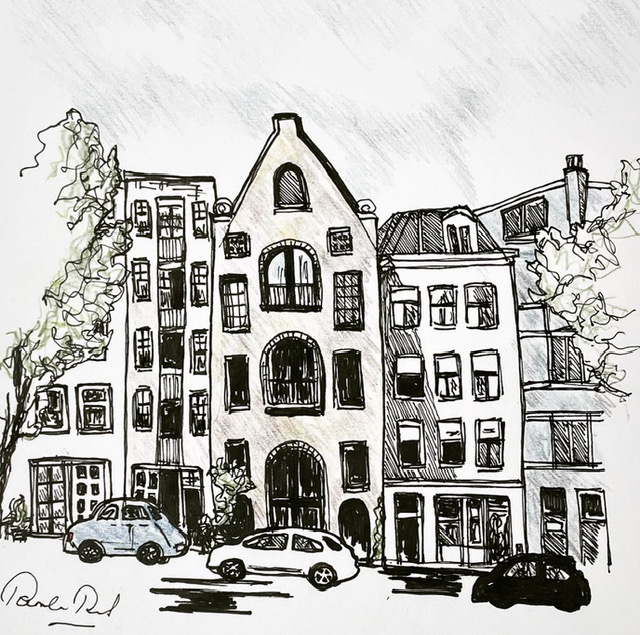
Image resolution: width=640 pixels, height=635 pixels. What are the coordinates of `door` in the screenshot? It's located at (58, 489), (81, 489), (141, 489), (297, 493), (364, 525).